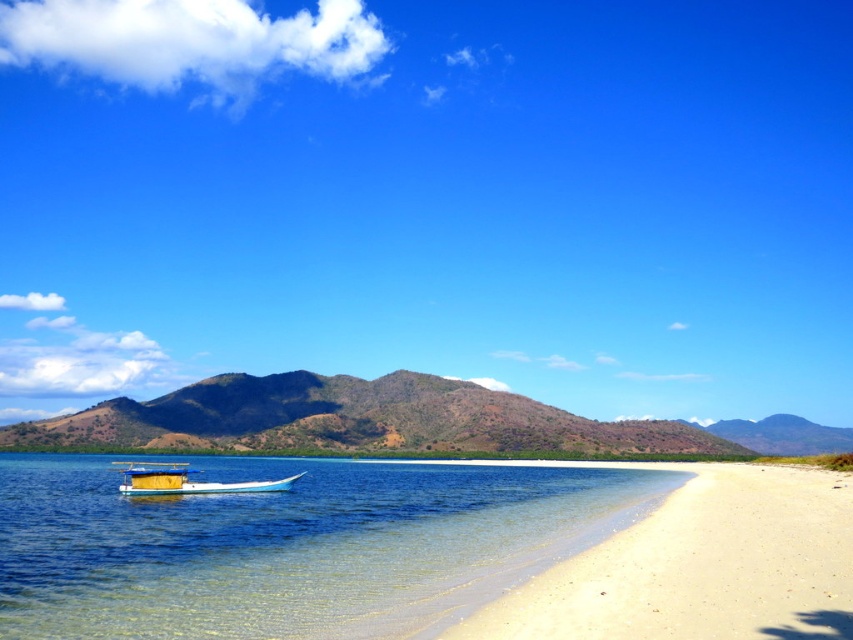
You are standing on the white sandy beach at lower right and want to reach the wooden boat at center. Based on the scene, which direction should you move to get closer to the boat?

The white sandy beach at lower right is shorter than the wooden boat at center, so you should move towards the center of the image to get closer to the boat.

You are a swimmer who wants to reach the wooden boat at center from the white sandy beach at lower right. Considering the distance between them is 29.10 meters, can you estimate how long it would take you to swim there if you swim at a pace of 1.5 meters per second?

The distance between the white sandy beach at lower right and the wooden boat at center is 29.10 meters. Swimming at 1.5 meters per second, it would take approximately 19.4 seconds to reach the wooden boat at center.